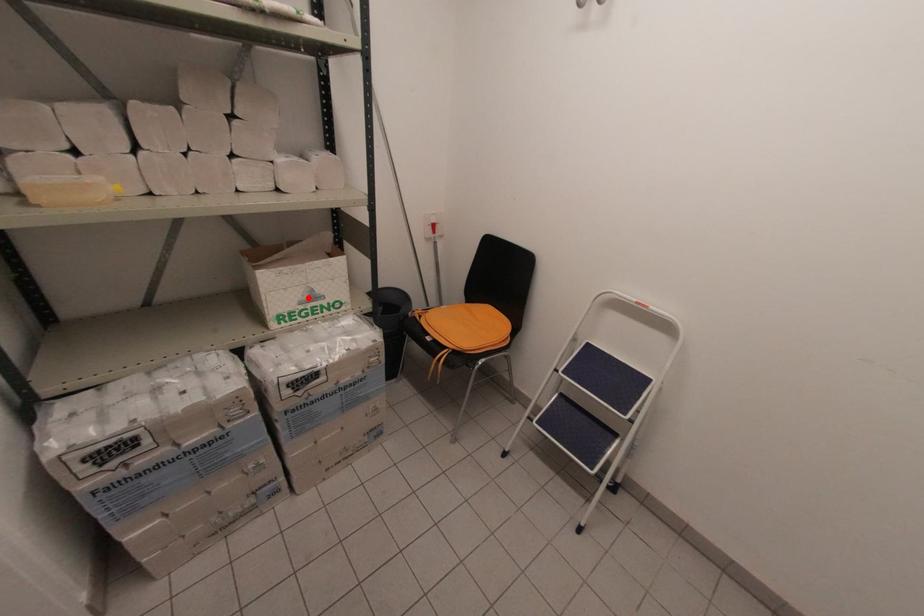
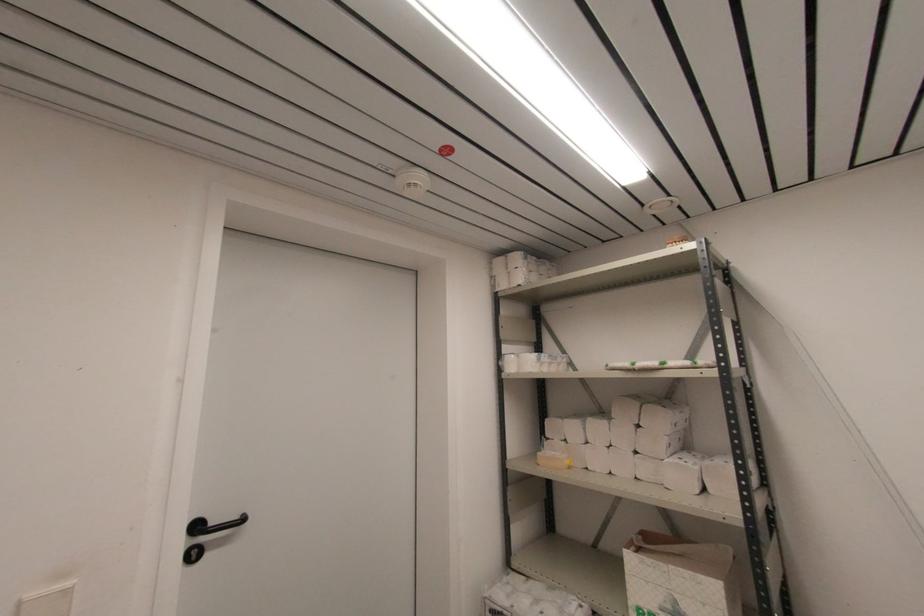
In the second image, find the point that corresponds to the highlighted location in the first image.

(671, 609)